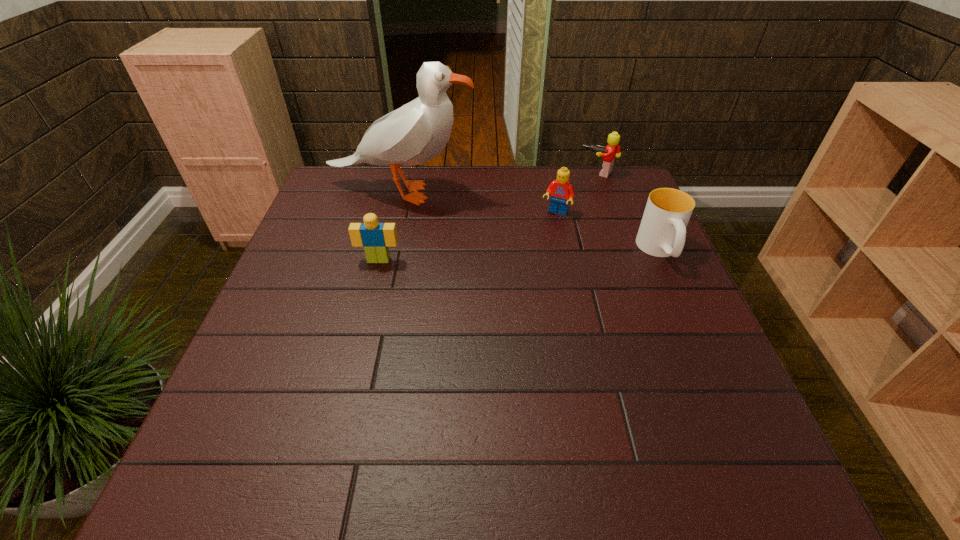
Find the location of a particular element. the leftmost Lego is located at coordinates (376, 237).

Locate an element on the screen. This screenshot has width=960, height=540. cup is located at coordinates (662, 232).

You are a GUI agent. You are given a task and a screenshot of the screen. Output one action in this format:
    pyautogui.click(x=<x>, y=<y>)
    Task: Click on the third object from left to right
    The image size is (960, 540).
    Given the screenshot: What is the action you would take?
    (x=561, y=190)

The height and width of the screenshot is (540, 960). I want to click on the second farthest Lego, so click(x=561, y=190).

This screenshot has width=960, height=540. What are the coordinates of `the farthest Lego` in the screenshot? It's located at (612, 150).

What are the coordinates of `gull` in the screenshot? It's located at (415, 133).

Where is `blank area located 0.350m on the face of the leftmost Lego`? blank area located 0.350m on the face of the leftmost Lego is located at coordinates (348, 386).

You are a GUI agent. You are given a task and a screenshot of the screen. Output one action in this format:
    pyautogui.click(x=<x>, y=<y>)
    Task: Click on the free location located with the handle on the side of the cup
    This screenshot has height=540, width=960.
    Given the screenshot: What is the action you would take?
    pyautogui.click(x=738, y=424)

Locate an element on the screen. free space located on the face of the second farthest Lego is located at coordinates (527, 263).

Where is `vacant point located on the face of the second farthest Lego`? vacant point located on the face of the second farthest Lego is located at coordinates (516, 283).